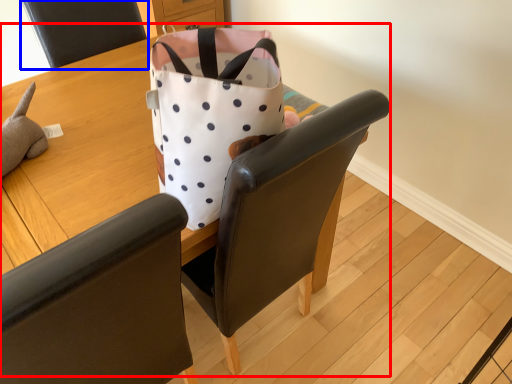
Question: Which object is further to the camera taking this photo, table (highlighted by a red box) or chair (highlighted by a blue box)?

Choices:
 (A) table
 (B) chair

Answer: (B)